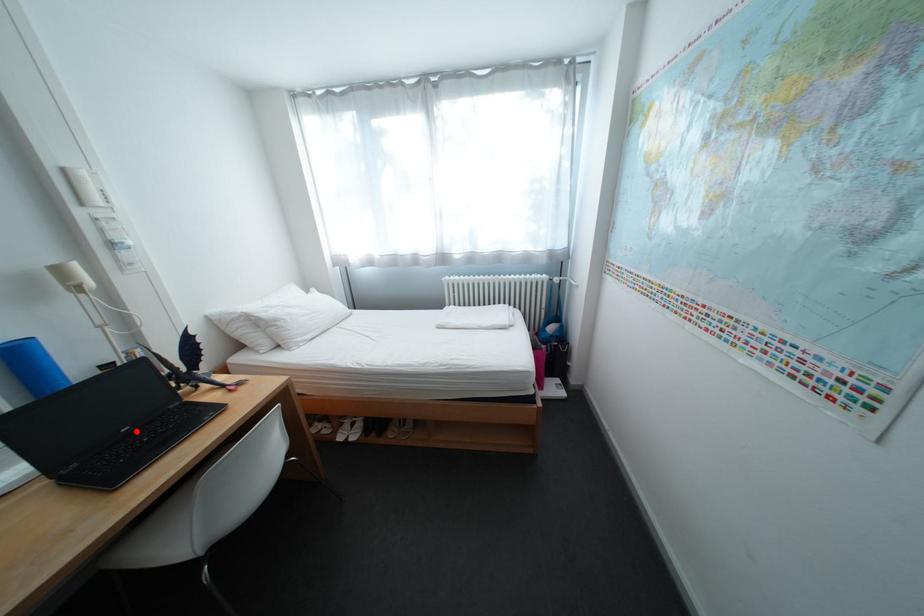
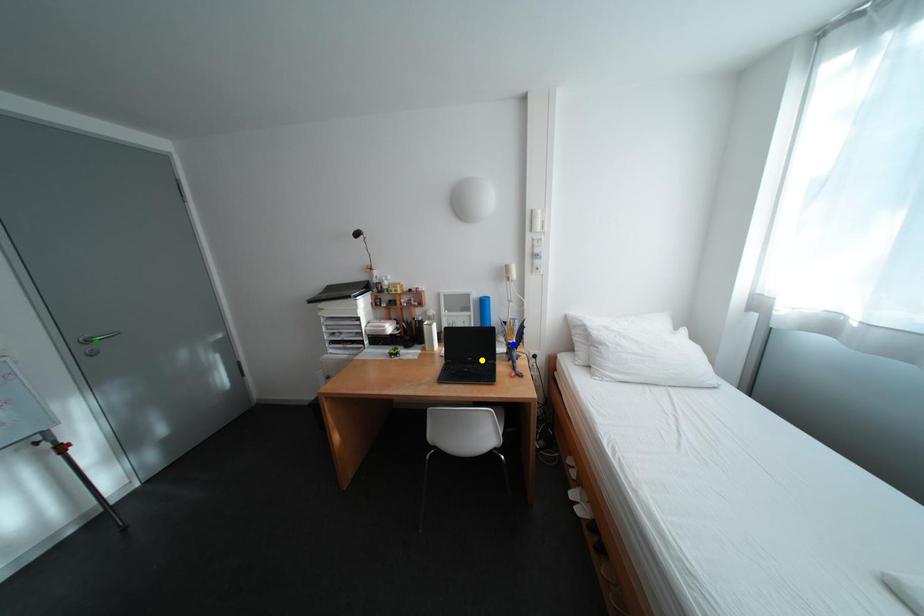
Question: I am providing you with two images of the same scene from different viewpoints. A red point is marked on the first image. You are given multiple points on the second image. Which mark in image 2 goes with the point in image 1?

Choices:
 (A) green point
 (B) blue point
 (C) yellow point

Answer: (C)